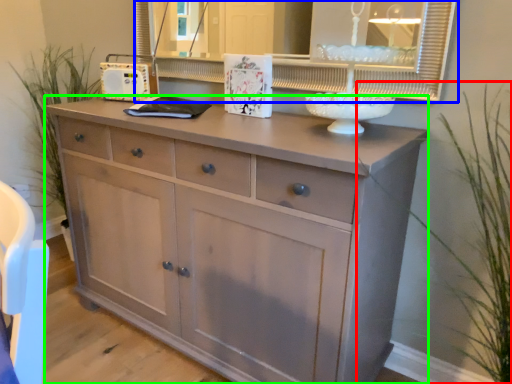
Question: Based on their relative distances, which object is farther from plant (highlighted by a red box)? Choose from medicine cabinet (highlighted by a blue box) and chest of drawers (highlighted by a green box).

Choices:
 (A) medicine cabinet
 (B) chest of drawers

Answer: (B)